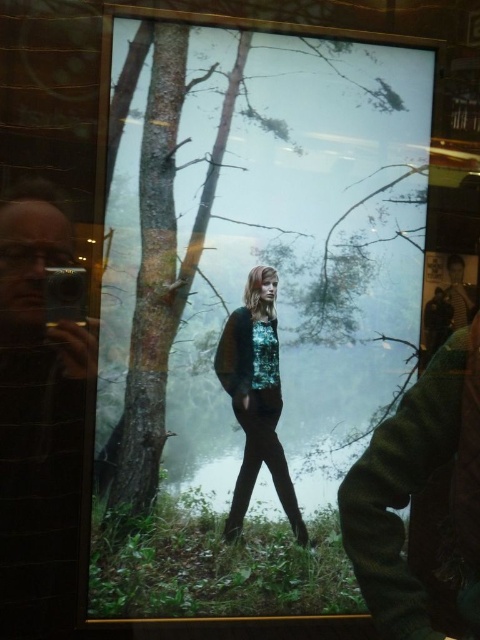
Question: Does matte black camera at left appear under shiny teal blouse at center?

Choices:
 (A) yes
 (B) no

Answer: (B)

Question: Is matte black camera at left above shiny teal blouse at center?

Choices:
 (A) no
 (B) yes

Answer: (B)

Question: Which of the following is the farthest from the observer?

Choices:
 (A) matte black camera at left
 (B) shiny teal blouse at center

Answer: (B)

Question: Does matte black camera at left appear under shiny teal blouse at center?

Choices:
 (A) no
 (B) yes

Answer: (A)